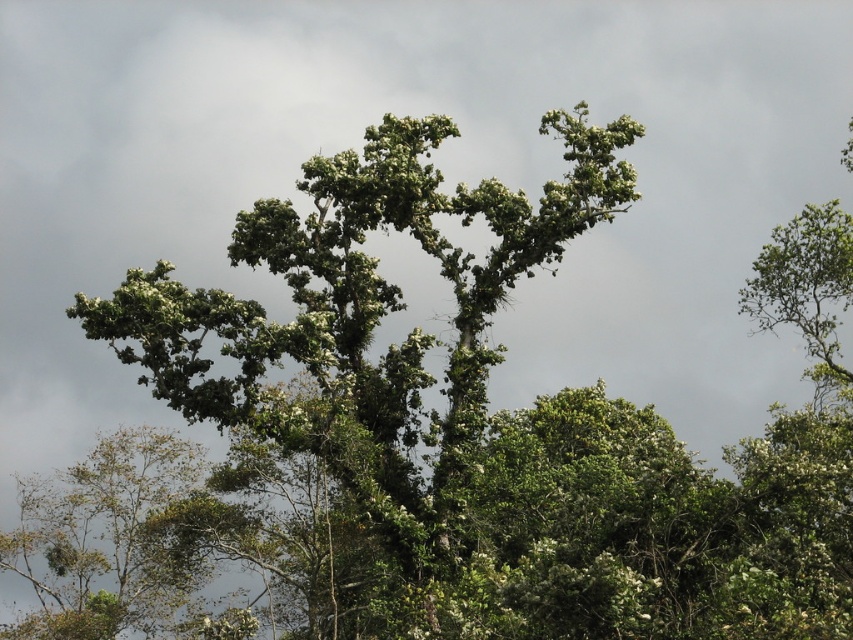
From the picture: Is green leafy tree at center thinner than green leafy tree at upper center?

No, green leafy tree at center is not thinner than green leafy tree at upper center.

Is green leafy tree at center in front of green leafy tree at upper center?

Yes, green leafy tree at center is closer to the viewer.

You are a GUI agent. You are given a task and a screenshot of the screen. Output one action in this format:
    pyautogui.click(x=<x>, y=<y>)
    Task: Click on the green leafy tree at center
    This screenshot has width=853, height=640.
    Given the screenshot: What is the action you would take?
    pyautogui.click(x=367, y=317)

Locate an element on the screen. The width and height of the screenshot is (853, 640). green leafy tree at center is located at coordinates (367, 317).